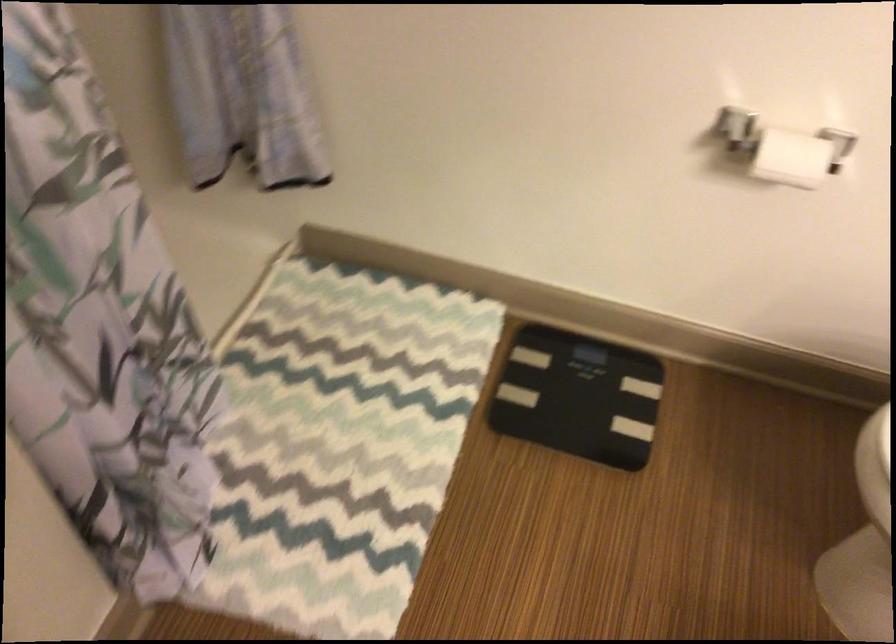
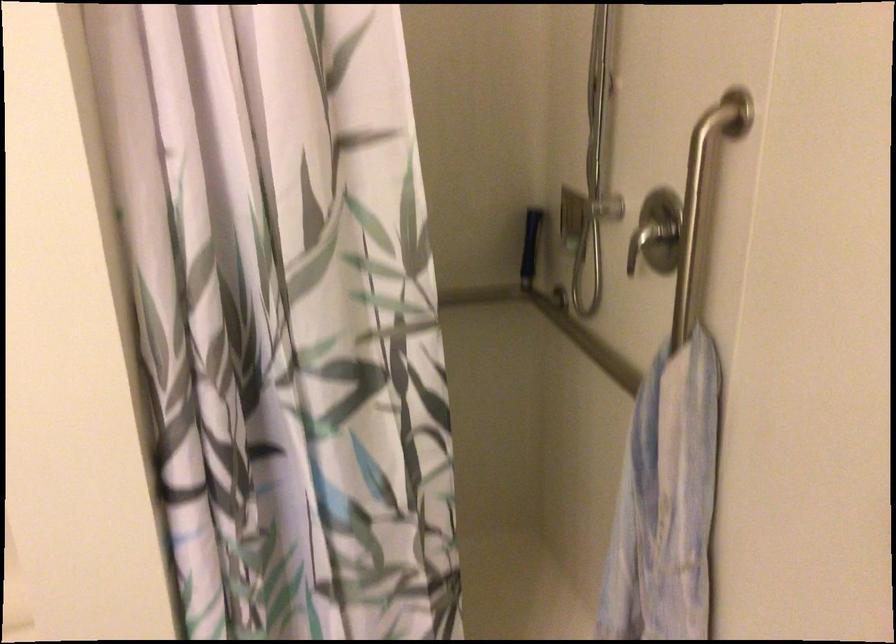
Question: The camera is either moving clockwise (left) or counter-clockwise (right) around the object. The first image is from the beginning of the video and the second image is from the end. Is the camera moving left or right when shooting the video?

Choices:
 (A) Left
 (B) Right

Answer: (B)